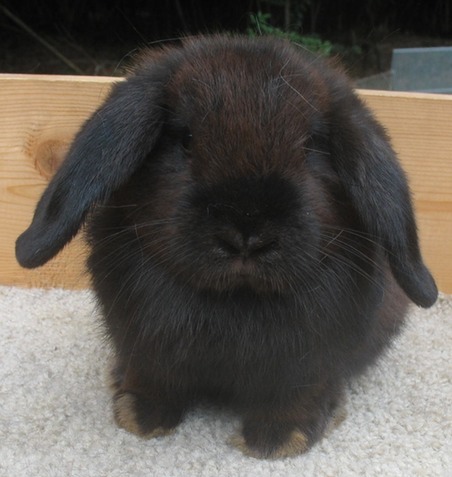
The height and width of the screenshot is (477, 452). Find the location of `carpet`. carpet is located at coordinates (72, 417), (184, 457), (390, 410), (431, 330), (32, 325).